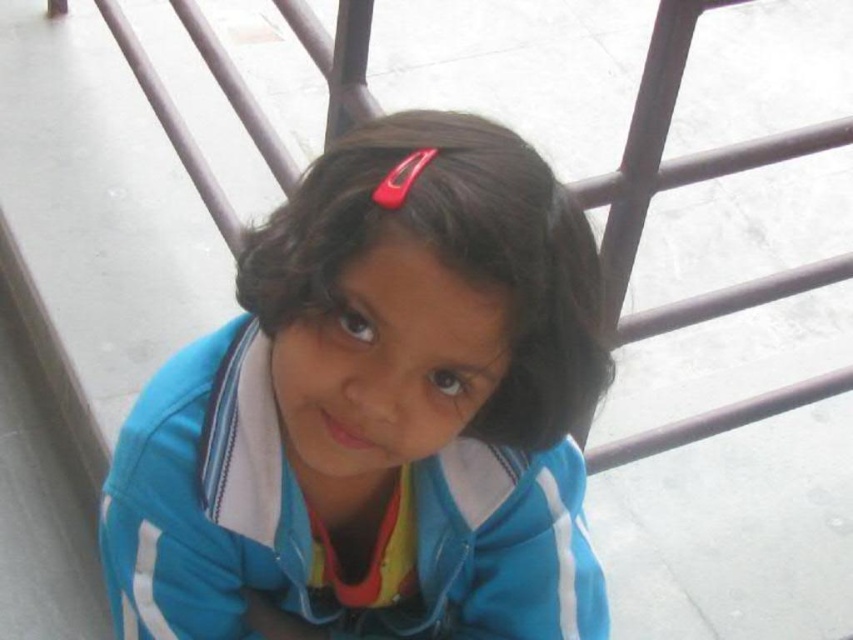
Who is taller, blue fabric jacket at center or dark brown silky hair at center?

blue fabric jacket at center

Can you confirm if blue fabric jacket at center is shorter than dark brown silky hair at center?

No, blue fabric jacket at center is not shorter than dark brown silky hair at center.

Is point (224, 596) less distant than point (335, 196)?

No, (224, 596) is further to viewer.

The image size is (853, 640). In order to click on blue fabric jacket at center in this screenshot , I will do `click(376, 412)`.